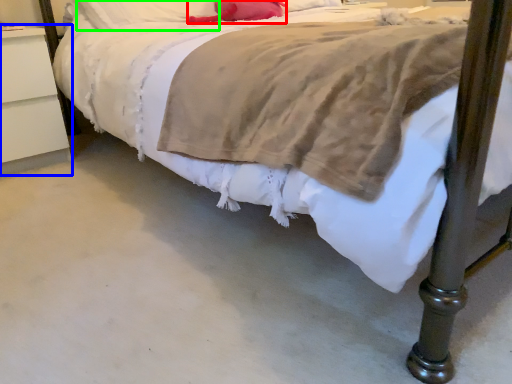
Question: Considering the real-world distances, which object is closest to pillow (highlighted by a red box)? nightstand (highlighted by a blue box) or pillow (highlighted by a green box).

Choices:
 (A) nightstand
 (B) pillow

Answer: (B)